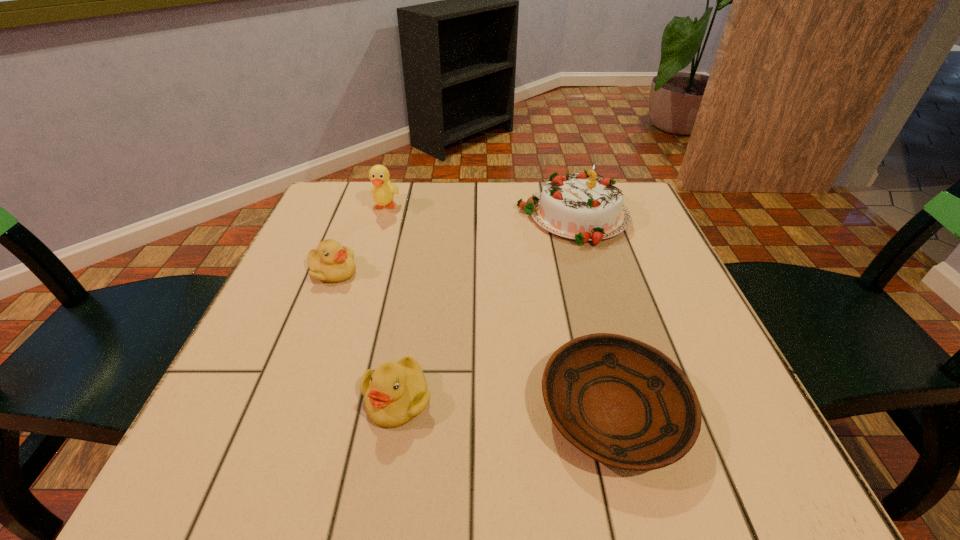
In the image, there is a desktop. At what (x,y) coordinates should I click in order to perform the action: click on blank space at the near edge. Please return your answer as a coordinate pair (x, y). The image size is (960, 540). Looking at the image, I should click on (516, 447).

The height and width of the screenshot is (540, 960). I want to click on vacant space at the left edge of the desktop, so click(280, 278).

The width and height of the screenshot is (960, 540). In the image, there is a desktop. What are the coordinates of `vacant space at the right edge` in the screenshot? It's located at (610, 274).

The width and height of the screenshot is (960, 540). In the image, there is a desktop. Identify the location of vacant space at the far left corner. (348, 194).

This screenshot has width=960, height=540. What are the coordinates of `free space at the near left corner` in the screenshot? It's located at (248, 441).

What are the coordinates of `vacant space at the far right corner of the desktop` in the screenshot? It's located at (637, 202).

At what (x,y) coordinates should I click in order to perform the action: click on free space that is in between the plate and the second nearest duckling. Please return your answer as a coordinate pair (x, y). This screenshot has height=540, width=960. Looking at the image, I should click on (473, 341).

At what (x,y) coordinates should I click in order to perform the action: click on free space between the third nearest object and the tallest duckling. Please return your answer as a coordinate pair (x, y). Looking at the image, I should click on (359, 239).

Find the location of a particular element. The image size is (960, 540). unoccupied position between the third nearest object and the shortest object is located at coordinates (473, 341).

Locate an element on the screen. vacant area between the nearest duckling and the second farthest duckling is located at coordinates (365, 335).